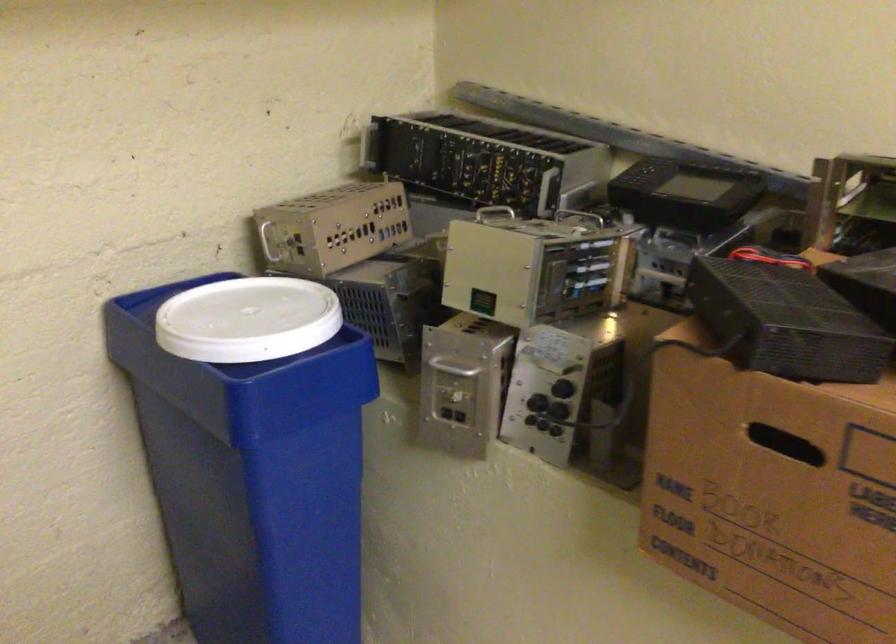
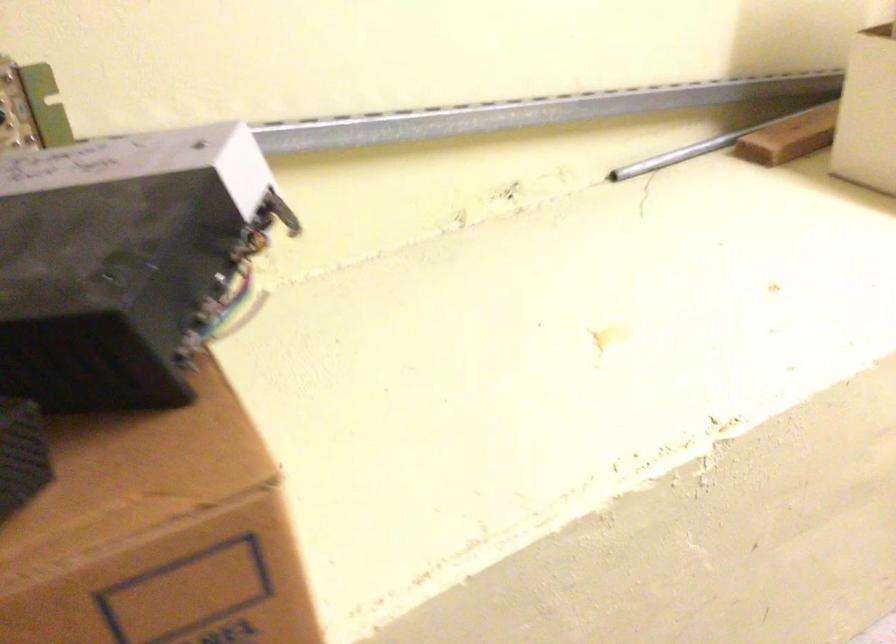
The images are taken continuously from a first-person perspective. In which direction is your viewpoint rotating?

The camera rotated toward right-down.